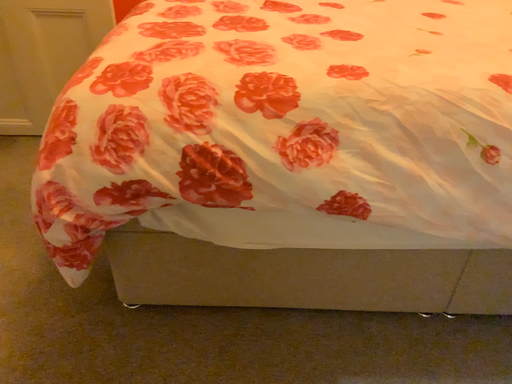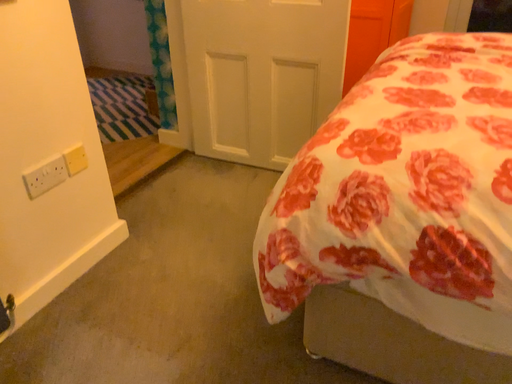
Question: How did the camera likely rotate when shooting the video?

Choices:
 (A) rotated right
 (B) rotated left

Answer: (B)